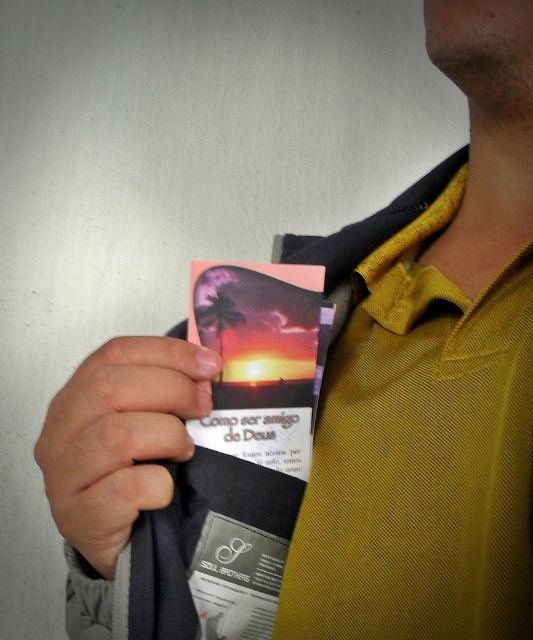
Question: Which point is farther to the camera?

Choices:
 (A) smooth skin hand at lower left
 (B) matte plastic card at center

Answer: (B)

Question: Does smooth skin hand at lower left have a greater width compared to matte plastic card at center?

Choices:
 (A) no
 (B) yes

Answer: (B)

Question: Among these objects, which one is farthest from the camera?

Choices:
 (A) matte plastic card at center
 (B) smooth skin hand at lower left

Answer: (A)

Question: Which of the following is the closest to the observer?

Choices:
 (A) smooth skin hand at lower left
 (B) matte plastic card at center

Answer: (A)

Question: Is smooth skin hand at lower left positioned at the back of matte plastic card at center?

Choices:
 (A) yes
 (B) no

Answer: (B)

Question: Does smooth skin hand at lower left appear under matte plastic card at center?

Choices:
 (A) yes
 (B) no

Answer: (A)